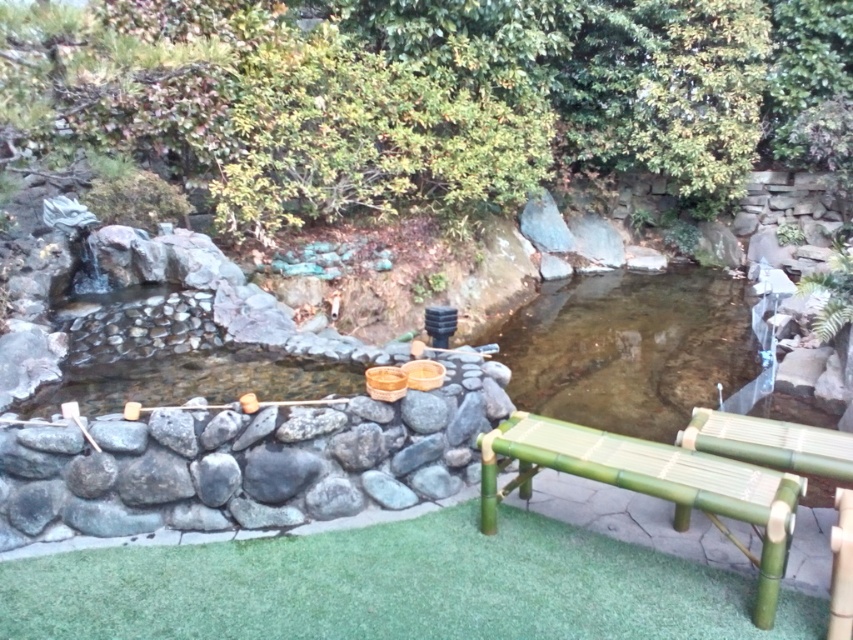
You are planning to place a small statue on the stone pathway near the green bamboo bench at lower right. Based on the scene, where should you position the statue so it doesn not block the view of the clear water at center?

The clear water at center is to the right of the green bamboo bench at lower right, so positioning the statue to the left side of the green bamboo bench at lower right would keep the view of the clear water at center unobstructed.

From the picture: You are planning to place a new decorative item on the pathway near the green bamboo bench at lower right. Considering the space available, can the item be wider than the clear water at center?

The clear water at center is wider than the green bamboo bench at lower right. Therefore, if the new decorative item is wider than the clear water at center, it might not fit in the space near the bench since the bench itself is narrower. However, if the item is narrower or equal in width to the clear water at center, it could potentially fit depending on the exact dimensions of the pathway.